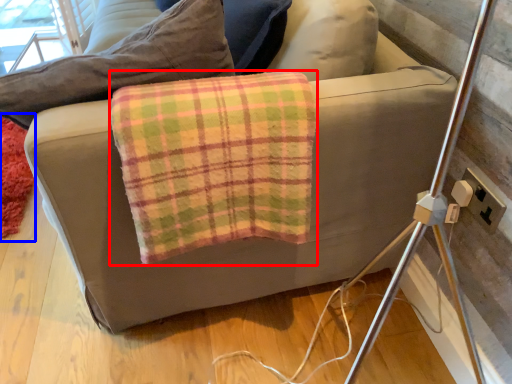
Question: Which object is further to the camera taking this photo, material (highlighted by a red box) or mat (highlighted by a blue box)?

Choices:
 (A) material
 (B) mat

Answer: (B)